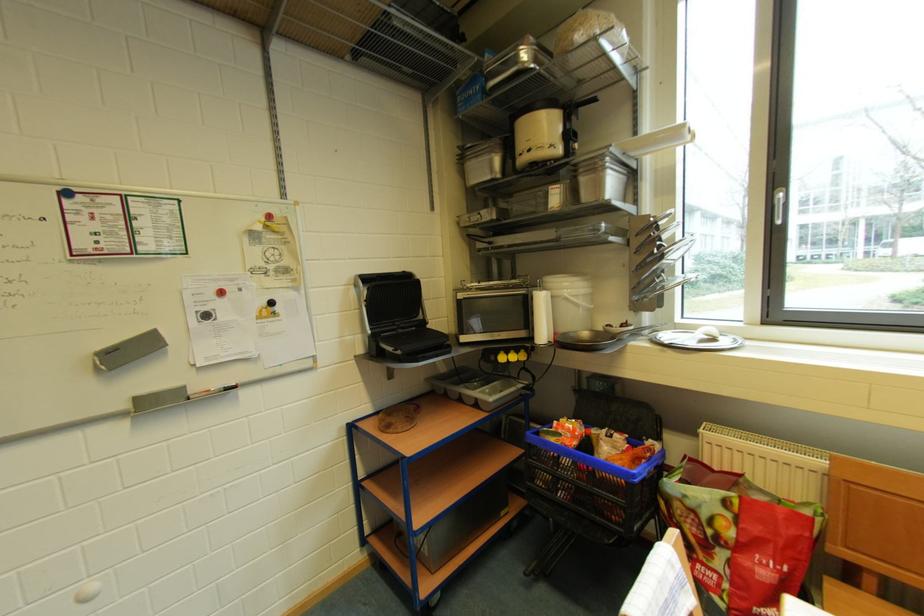
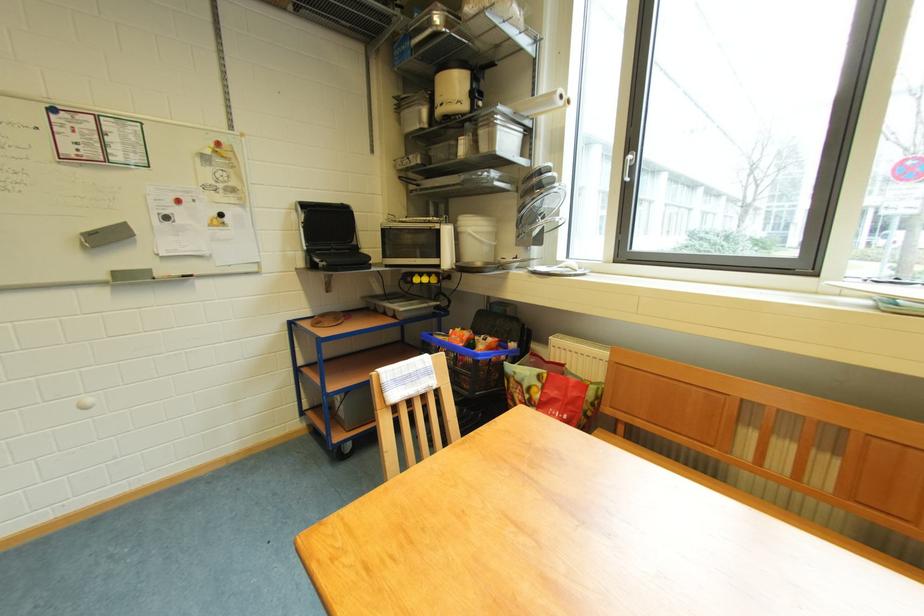
Find the pixel in the second image that matches (x=110, y=370) in the first image.

(95, 248)